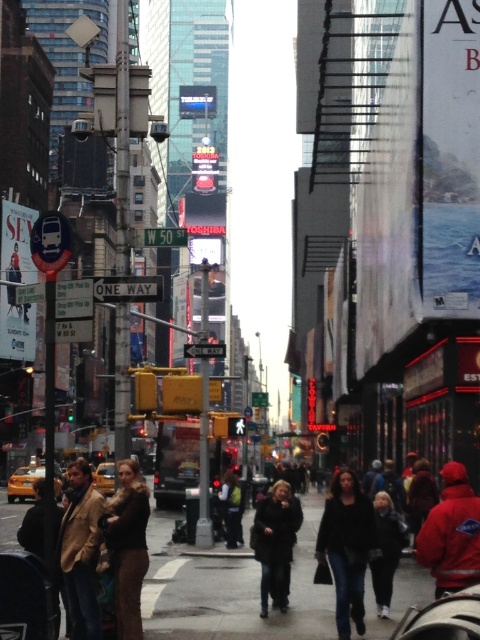
Question: Considering the real-world distances, which object is farthest from the smooth asphalt pavement at lower center?

Choices:
 (A) dark brown leather jacket at lower left
 (B) dark gray jacket at center
 (C) black leather coat at lower right
 (D) dark brown leather jacket at lower right

Answer: (C)

Question: Among these points, which one is nearest to the camera?

Choices:
 (A) (370, 493)
 (B) (228, 532)
 (C) (136, 477)

Answer: (C)

Question: Is dark brown leather coat at center smaller than dark brown leather jacket at lower left?

Choices:
 (A) no
 (B) yes

Answer: (B)

Question: Observing the image, what is the correct spatial positioning of tan leather jacket at lower left in reference to dark blue jeans at center?

Choices:
 (A) above
 (B) below

Answer: (A)

Question: Among these points, which one is farthest from the camera?

Choices:
 (A) (279, 540)
 (B) (62, 628)

Answer: (A)

Question: Can you confirm if smooth asphalt pavement at lower center is positioned below brown fuzzy coat at lower left?

Choices:
 (A) no
 (B) yes

Answer: (B)